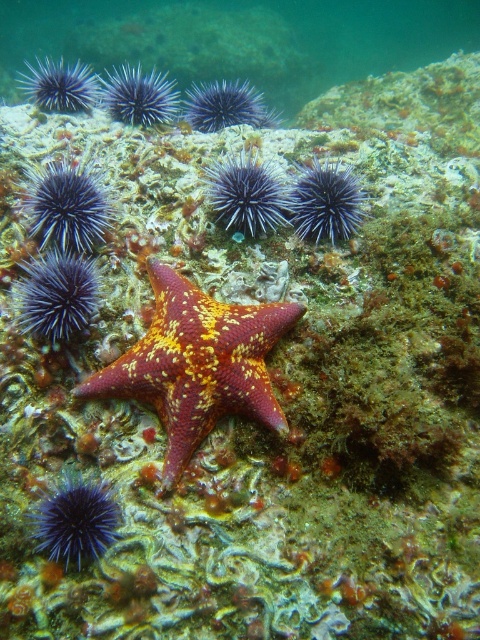
Can you confirm if purple spiny sea urchins at upper left is bigger than shiny orange starfish at center?

Indeed, purple spiny sea urchins at upper left has a larger size compared to shiny orange starfish at center.

This screenshot has height=640, width=480. I want to click on purple spiny sea urchins at upper left, so tap(241, 38).

You are a GUI agent. You are given a task and a screenshot of the screen. Output one action in this format:
    pyautogui.click(x=<x>, y=<y>)
    Task: Click on the purple spiny sea urchins at upper left
    
    Given the screenshot: What is the action you would take?
    pyautogui.click(x=241, y=38)